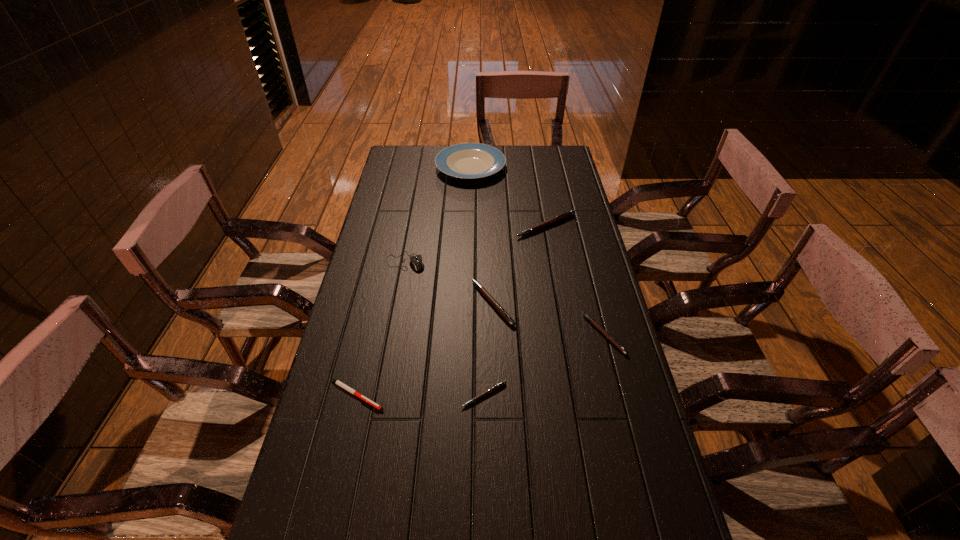
Where is `blue plate`? The width and height of the screenshot is (960, 540). blue plate is located at coordinates (466, 160).

I want to click on plate, so click(466, 160).

Find the location of a particular element. The image size is (960, 540). computer mouse is located at coordinates tap(416, 260).

The image size is (960, 540). In order to click on the farthest pink pen in this screenshot , I will do `click(568, 214)`.

Find the location of a particular element. Image resolution: width=960 pixels, height=540 pixels. the tallest pen is located at coordinates (568, 214).

The height and width of the screenshot is (540, 960). What are the coordinates of `the fourth tallest object` in the screenshot? It's located at (497, 306).

You are a GUI agent. You are given a task and a screenshot of the screen. Output one action in this format:
    pyautogui.click(x=<x>, y=<y>)
    Task: Click on the third smallest pink pen
    
    Given the screenshot: What is the action you would take?
    pyautogui.click(x=497, y=306)

The width and height of the screenshot is (960, 540). In order to click on the fifth tallest object in this screenshot , I will do `click(593, 322)`.

You are a GUI agent. You are given a task and a screenshot of the screen. Output one action in this format:
    pyautogui.click(x=<x>, y=<y>)
    Task: Click on the third tallest pen
    Image resolution: width=960 pixels, height=540 pixels.
    Given the screenshot: What is the action you would take?
    pyautogui.click(x=593, y=322)

At what (x,y) coordinates should I click in order to perform the action: click on the nearest pink pen. Please return your answer as a coordinate pair (x, y). This screenshot has width=960, height=540. Looking at the image, I should click on (497, 386).